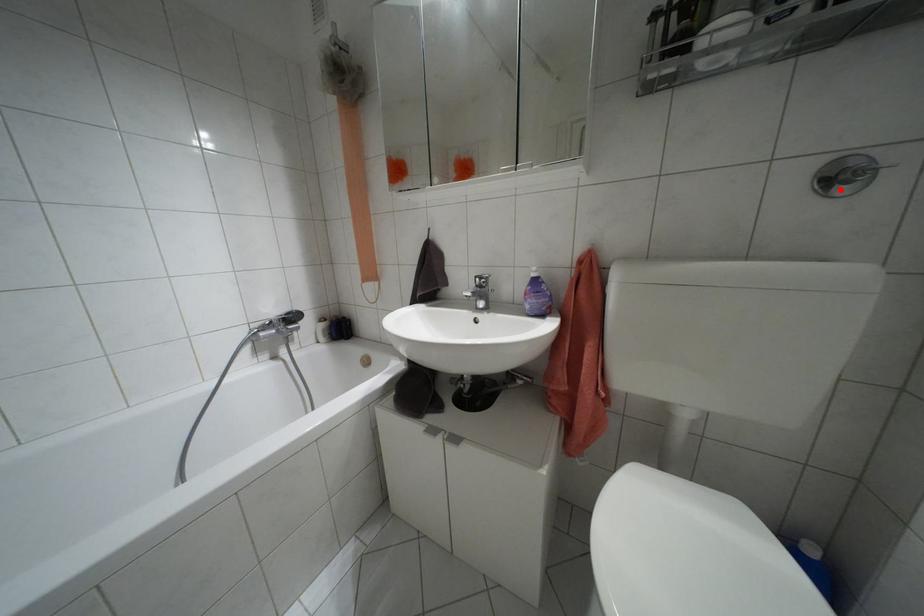
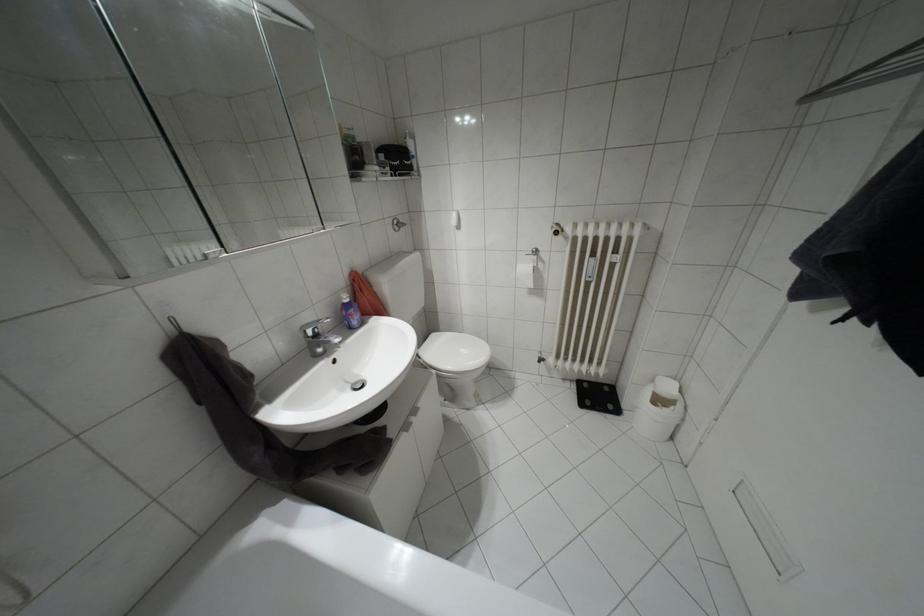
Locate, in the second image, the point that corresponds to the highlighted location in the first image.

(395, 229)